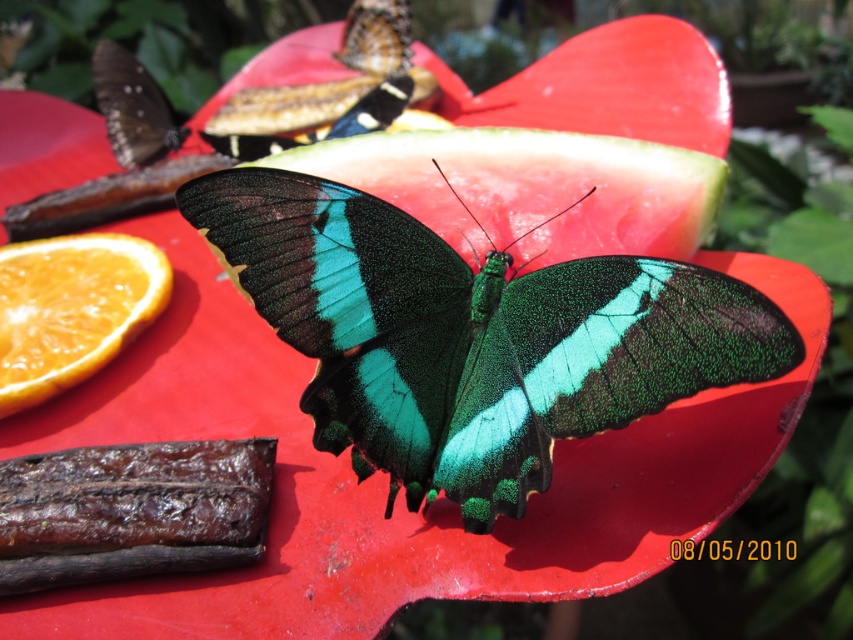
You are standing in the garden scene and want to place a small decoration between the two points, point (28,365) and point (142,124). Which point should the decoration be closer to in order to be visible from your current position?

The decoration should be closer to point (28,365) because it is in front of point (142,124), so placing it near that point would make it more visible from your current position.